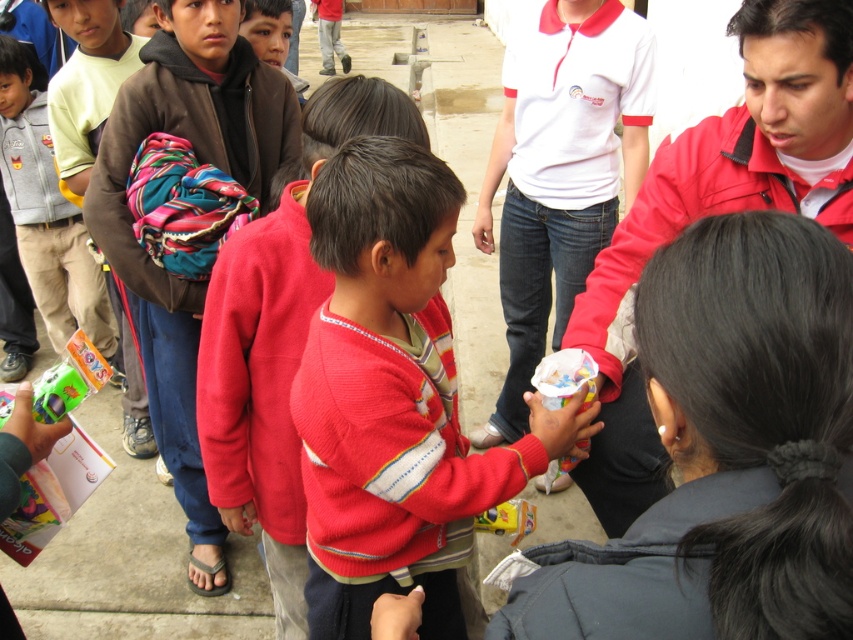
Consider the image. Which is above, knitted red sweater at center or brown fleece jacket at upper left?

brown fleece jacket at upper left is above.

Does point (520, 444) lie in front of point (184, 410)?

Yes, it is.

Does point (332, 433) come farther from viewer compared to point (276, 131)?

No, it is in front of (276, 131).

Identify the location of knitted red sweater at center. This screenshot has width=853, height=640. (393, 397).

Who is more forward, (422, 419) or (222, 496)?

Positioned in front is point (422, 419).

Can you confirm if knitted red sweater at center is positioned above knitted sweater at center?

No.

Which is in front, point (433, 593) or point (282, 374)?

Point (433, 593)

Locate an element on the screen. knitted red sweater at center is located at coordinates (393, 397).

Does matte red jacket at center have a lesser width compared to knitted sweater at center?

Indeed, matte red jacket at center has a lesser width compared to knitted sweater at center.

Image resolution: width=853 pixels, height=640 pixels. Describe the element at coordinates (717, 212) in the screenshot. I see `matte red jacket at center` at that location.

Which is behind, point (590, 484) or point (256, 237)?

The point (256, 237) is more distant.

At what (x,y) coordinates should I click in order to perform the action: click on matte red jacket at center. Please return your answer as a coordinate pair (x, y). Looking at the image, I should click on (717, 212).